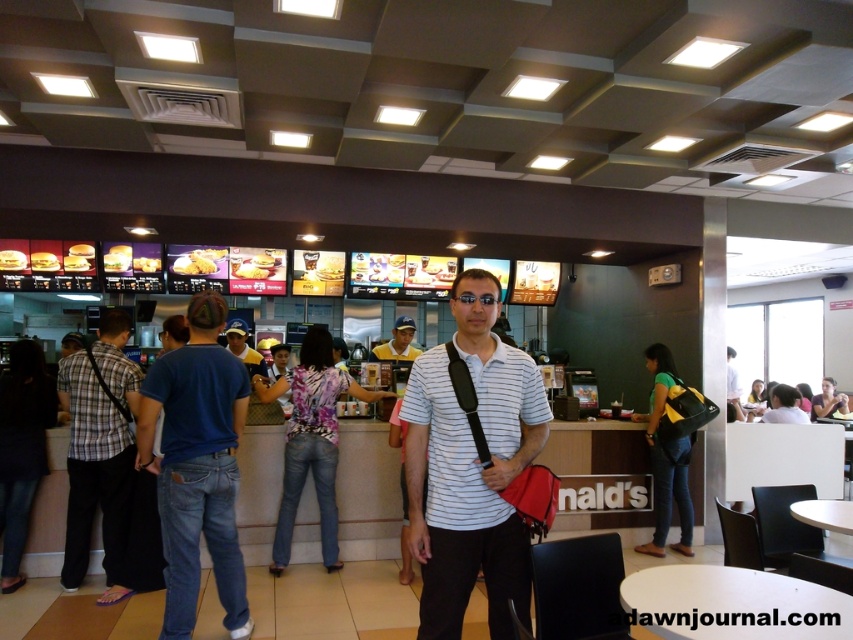
Question: Which point is farther from the camera taking this photo?

Choices:
 (A) (824, 396)
 (B) (73, 426)
 (C) (55, 259)

Answer: (A)

Question: Can you confirm if blue jeans at center is positioned below golden crispy burger at center?

Choices:
 (A) yes
 (B) no

Answer: (A)

Question: Is plaid shirt at left bigger than light blue fabric shirt at center?

Choices:
 (A) no
 (B) yes

Answer: (B)

Question: Which point is closer to the camera?

Choices:
 (A) (190, 353)
 (B) (405, 353)

Answer: (A)

Question: Which object appears farthest from the camera in this image?

Choices:
 (A) plaid shirt at left
 (B) blue jeans at center
 (C) light blue fabric shirt at center
 (D) matte white shirt at center

Answer: (D)

Question: In this image, where is plaid shirt at left located relative to matte white shirt at center?

Choices:
 (A) above
 (B) below

Answer: (A)